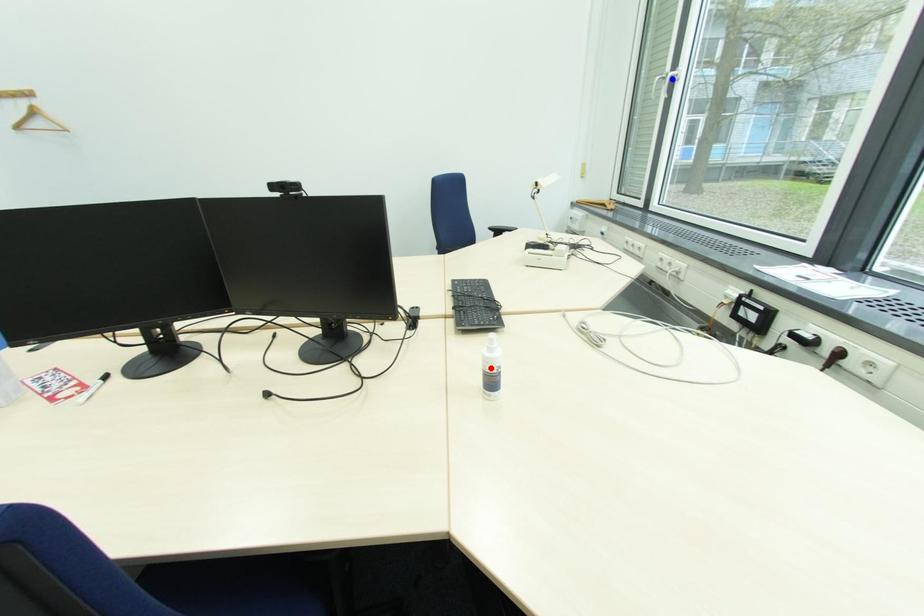
Question: In the image, two points are highlighted. Which point is nearer to the camera? Reply with the corresponding letter.

Choices:
 (A) blue point
 (B) red point

Answer: (B)